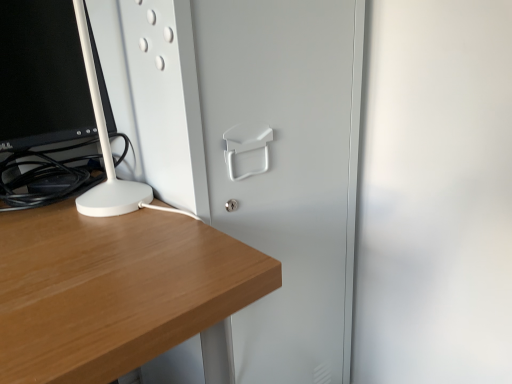
Question: Considering the relative sizes of black glossy computer monitor at left and white matte glass door at center in the image provided, is black glossy computer monitor at left taller than white matte glass door at center?

Choices:
 (A) yes
 (B) no

Answer: (B)

Question: From the image's perspective, is black glossy computer monitor at left on top of white matte glass door at center?

Choices:
 (A) yes
 (B) no

Answer: (A)

Question: Are black glossy computer monitor at left and white matte glass door at center located far from each other?

Choices:
 (A) yes
 (B) no

Answer: (B)

Question: Is black glossy computer monitor at left not inside white matte glass door at center?

Choices:
 (A) yes
 (B) no

Answer: (A)

Question: Can you confirm if black glossy computer monitor at left is bigger than white matte glass door at center?

Choices:
 (A) yes
 (B) no

Answer: (B)

Question: Considering the relative sizes of black glossy computer monitor at left and white matte glass door at center in the image provided, is black glossy computer monitor at left wider than white matte glass door at center?

Choices:
 (A) yes
 (B) no

Answer: (B)

Question: Is white matte glass door at center positioned with its back to black glossy computer monitor at left?

Choices:
 (A) yes
 (B) no

Answer: (B)

Question: From the image's perspective, is white matte glass door at center on top of black glossy computer monitor at left?

Choices:
 (A) no
 (B) yes

Answer: (A)

Question: Is the position of white matte glass door at center more distant than that of black glossy computer monitor at left?

Choices:
 (A) yes
 (B) no

Answer: (B)

Question: Can you confirm if white matte glass door at center is smaller than black glossy computer monitor at left?

Choices:
 (A) no
 (B) yes

Answer: (A)

Question: From the image's perspective, is white matte glass door at center located beneath black glossy computer monitor at left?

Choices:
 (A) no
 (B) yes

Answer: (B)

Question: Is white matte glass door at center positioned beyond the bounds of black glossy computer monitor at left?

Choices:
 (A) yes
 (B) no

Answer: (A)

Question: Considering the positions of point (93, 43) and point (265, 92), is point (93, 43) closer or farther from the camera than point (265, 92)?

Choices:
 (A) closer
 (B) farther

Answer: (B)